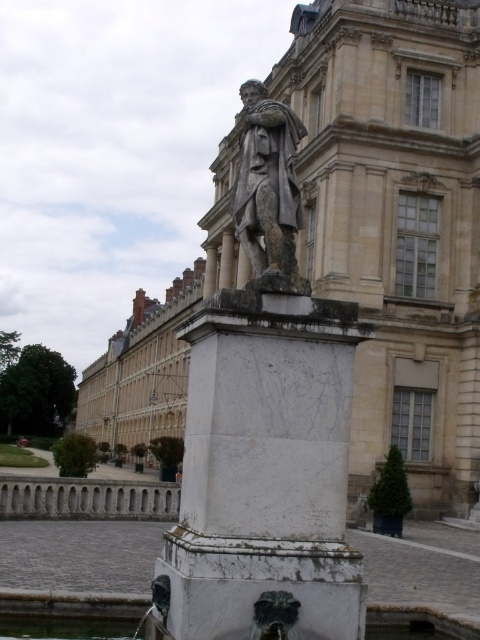
You are an architect designing a new plaza and need to place a small decorative fountain between the white marble pedestal at center and the gray stone statue at center. Based on their heights, which object should the fountain be placed closer to?

The fountain should be placed closer to the white marble pedestal at center because it is shorter than the gray stone statue at center, so positioning the fountain near the shorter object would create a balanced visual composition.

You are an art student visiting this historical building and notice two statues at the center. Which statue, the marble statue at center or the gray stone statue at center, is bigger?

The marble statue at center is larger in size than the gray stone statue at center.

You are an architect planning to install a new light fixture between the white marble pedestal at center and the gray stone statue at center. The light fixture requires a minimum of 5 meters of space between the pedestal and statue to be safely installed. Based on the scene description, can the light fixture be installed?

The white marble pedestal at center and gray stone statue at center are 5.37 meters apart from each other. Since the required minimum space is 5 meters, the light fixture can be installed safely between them.